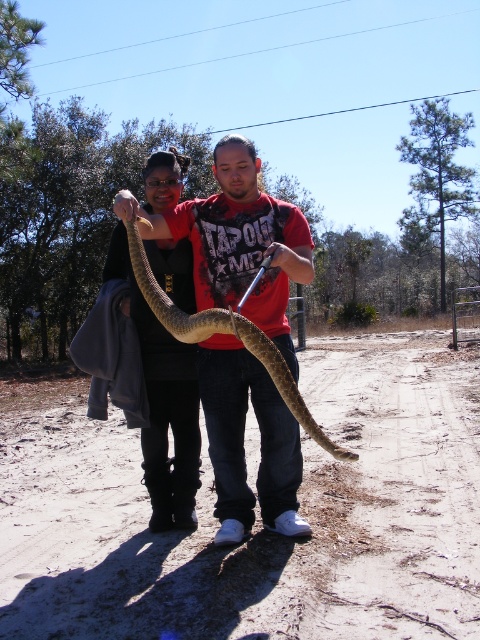
The width and height of the screenshot is (480, 640). What do you see at coordinates (256, 516) in the screenshot? I see `dirt track at lower center` at bounding box center [256, 516].

Is dirt track at lower center smaller than brown scaly snake at center?

Incorrect, dirt track at lower center is not smaller in size than brown scaly snake at center.

Measure the distance between dirt track at lower center and camera.

9.41 feet

Find the location of `dirt track at lower center`. dirt track at lower center is located at coordinates (256, 516).